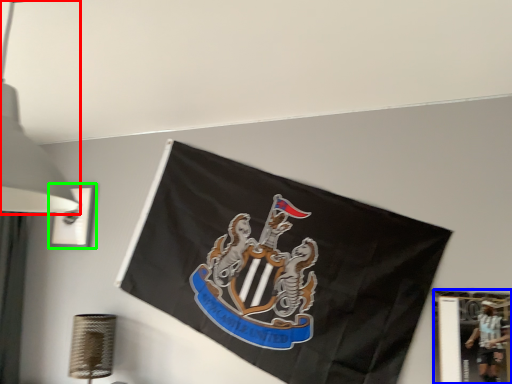
Question: Based on their relative distances, which object is nearer to lamp (highlighted by a red box)? Choose from picture frame (highlighted by a blue box) and picture frame (highlighted by a green box).

Choices:
 (A) picture frame
 (B) picture frame

Answer: (A)